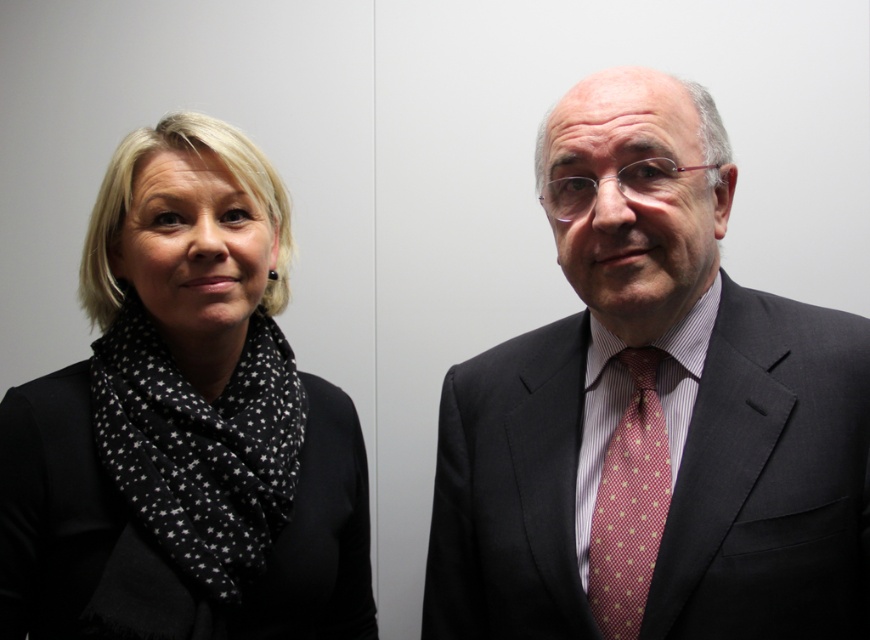
Question: Observing the image, what is the correct spatial positioning of dark gray suit at right in reference to pink dotted fabric tie at center?

Choices:
 (A) below
 (B) above

Answer: (B)

Question: Which point appears farthest from the camera in this image?

Choices:
 (A) (45, 493)
 (B) (496, 531)

Answer: (A)

Question: Which of the following is the farthest from the observer?

Choices:
 (A) black dotted scarf at left
 (B) dark gray suit at right
 (C) pink dotted fabric tie at center

Answer: (A)

Question: Which object is farther from the camera taking this photo?

Choices:
 (A) pink dotted fabric tie at center
 (B) dark gray suit at right
 (C) black dotted scarf at left

Answer: (C)

Question: Can you confirm if dark gray suit at right is positioned above black dotted scarf at left?

Choices:
 (A) no
 (B) yes

Answer: (B)

Question: Can you confirm if dark gray suit at right is positioned to the right of black dotted scarf at left?

Choices:
 (A) yes
 (B) no

Answer: (A)